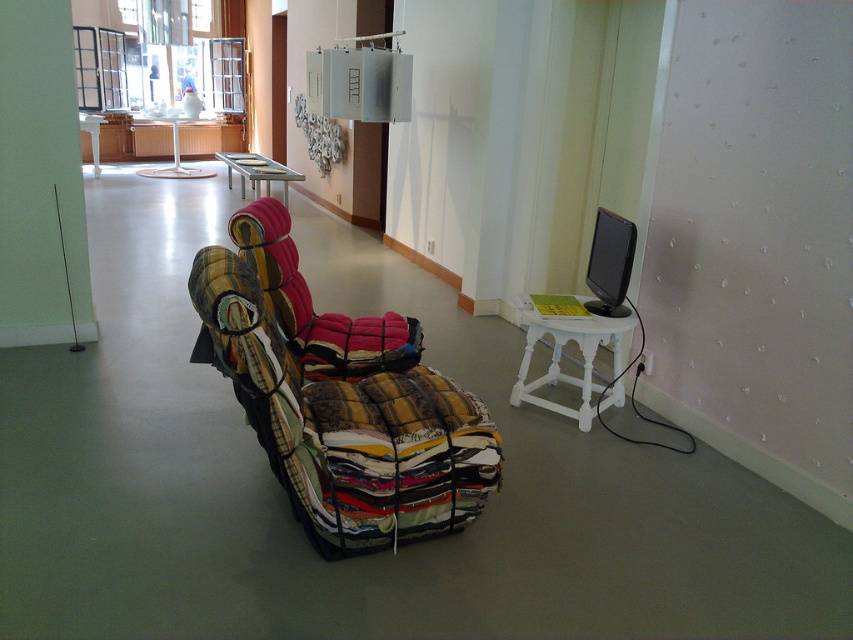
You are an interior designer planning to rearrange the furniture in the art gallery. You need to place a new large sculpture that requires a lot of space. Which object, the white wooden stool at right or the metallic silver table at upper center, should you move to accommodate the sculpture?

You should move the white wooden stool at right because it occupies less space than the metallic silver table at upper center, making it easier to relocate to accommodate the sculpture.

Consider the image. You are an interior designer planning to place a new table between the patchwork fabric chair at center and the white wooden stool at right. Which object should the table be closer to if it needs to accommodate the wider space requirement?

The table should be closer to the patchwork fabric chair at center because its width is larger than the white wooden stool at right, requiring more space.